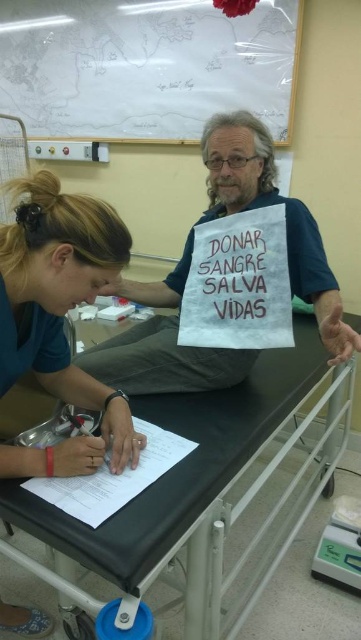
Question: Is matte blue shirt at lower left above blue fabric sign at center?

Choices:
 (A) no
 (B) yes

Answer: (A)

Question: Can you confirm if matte blue shirt at lower left is smaller than blue fabric sign at center?

Choices:
 (A) yes
 (B) no

Answer: (A)

Question: Which object is farther from the camera taking this photo?

Choices:
 (A) blue fabric sign at center
 (B) matte blue shirt at lower left

Answer: (A)

Question: Among these points, which one is farthest from the camera?

Choices:
 (A) (51, 268)
 (B) (216, 134)

Answer: (B)

Question: Which of the following is the farthest from the observer?

Choices:
 (A) (89, 269)
 (B) (197, 221)

Answer: (B)

Question: From the image, what is the correct spatial relationship of matte blue shirt at lower left in relation to blue fabric sign at center?

Choices:
 (A) right
 (B) left

Answer: (B)